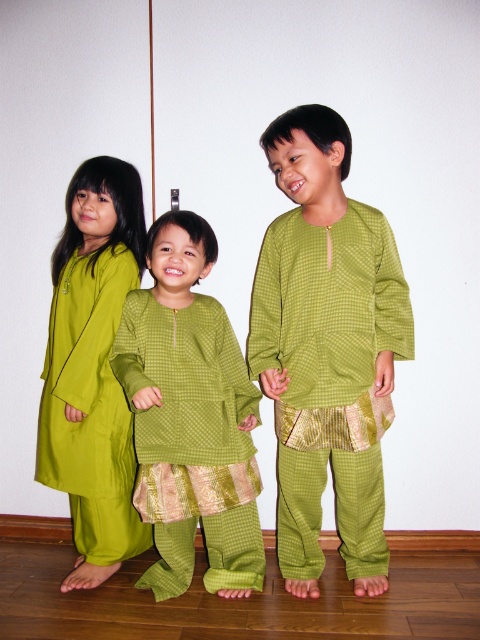
Question: Does green checkered shirt at center appear on the right side of matte green dress at left?

Choices:
 (A) no
 (B) yes

Answer: (B)

Question: Which point is closer to the camera taking this photo?

Choices:
 (A) (96, 164)
 (B) (215, 314)

Answer: (B)

Question: Can you confirm if green checkered shirt at center is smaller than matte green dress at left?

Choices:
 (A) yes
 (B) no

Answer: (B)

Question: Which of the following is the closest to the observer?

Choices:
 (A) (267, 355)
 (B) (175, 464)
 (C) (85, 572)

Answer: (B)

Question: From the image, what is the correct spatial relationship of green checkered shirt at center in relation to green textured kurta at center?

Choices:
 (A) right
 (B) left

Answer: (A)

Question: Which of these objects is positioned farthest from the green checkered shirt at center?

Choices:
 (A) green textured kurta at center
 (B) matte green dress at left

Answer: (B)